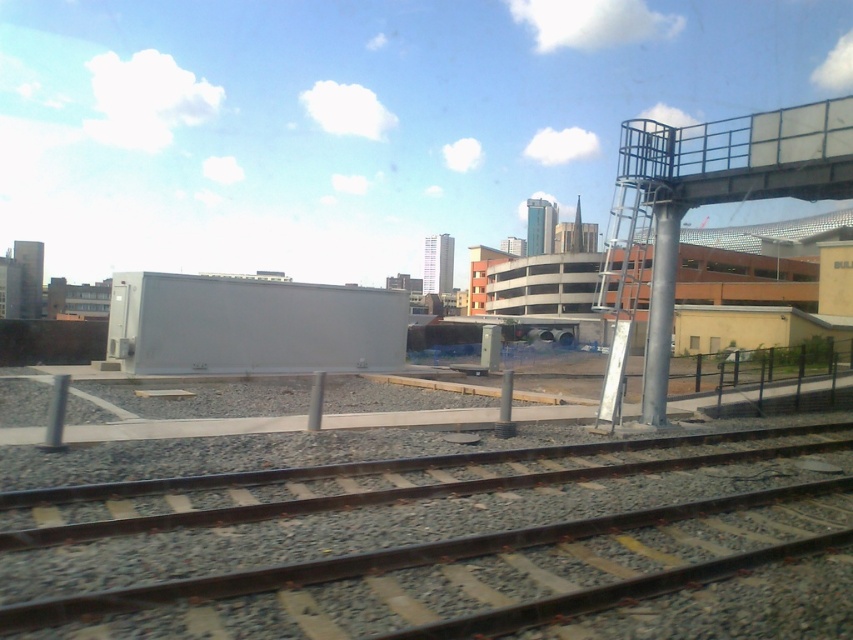
Locate an element on the screen. rusty metal train track at lower center is located at coordinates (415, 541).

Does point (461, 509) come farther from viewer compared to point (653, 122)?

No, it is in front of (653, 122).

Measure the distance between rusty metal train track at lower center and camera.

4.31 meters

Locate an element on the screen. rusty metal train track at lower center is located at coordinates (415, 541).